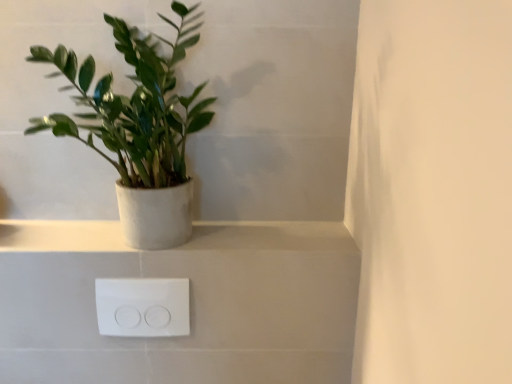
Question: In terms of width, does white matte/porcelain shelf at upper center look wider or thinner when compared to white plastic outlet at lower center?

Choices:
 (A) wide
 (B) thin

Answer: (A)

Question: From the image's perspective, is white matte/porcelain shelf at upper center positioned above or below white plastic outlet at lower center?

Choices:
 (A) below
 (B) above

Answer: (B)

Question: Which is farther from the white plastic outlet at lower center?

Choices:
 (A) green matte plant at left
 (B) white matte/porcelain shelf at upper center

Answer: (A)

Question: Based on their relative distances, which object is nearer to the white plastic outlet at lower center?

Choices:
 (A) white matte/porcelain shelf at upper center
 (B) green matte plant at left

Answer: (A)